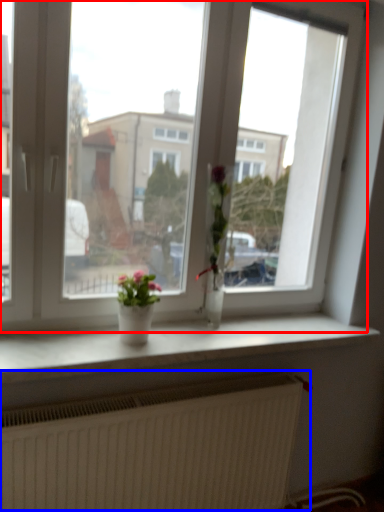
Question: Which point is further to the camera, window (highlighted by a red box) or radiator (highlighted by a blue box)?

Choices:
 (A) window
 (B) radiator

Answer: (B)